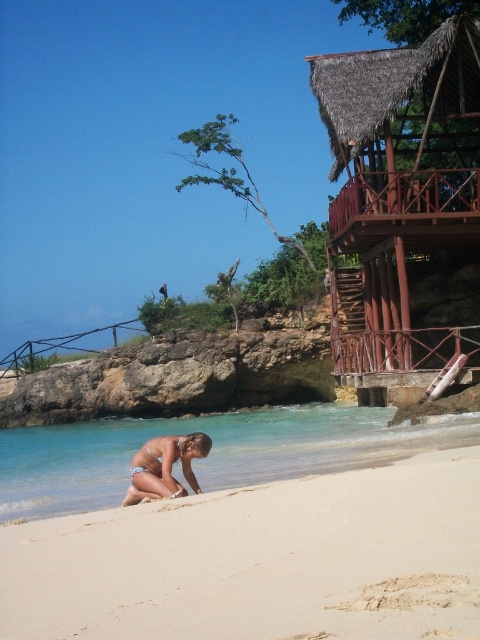
Which is in front, point (336, 636) or point (410, 170)?

Point (336, 636) is in front.

Is white sandy beach at lower center thinner than thatched wood hut at upper right?

Indeed, white sandy beach at lower center has a lesser width compared to thatched wood hut at upper right.

Describe the element at coordinates (261, 561) in the screenshot. I see `white sandy beach at lower center` at that location.

I want to click on white sandy beach at lower center, so click(x=261, y=561).

Which of these two, white sandy beach at lower center or clear blue water at lower center, stands shorter?

white sandy beach at lower center is shorter.

Is point (282, 593) in front of point (87, 428)?

That is True.

Is point (408, 506) closer to camera compared to point (111, 452)?

Yes, point (408, 506) is closer to viewer.

Image resolution: width=480 pixels, height=640 pixels. What are the coordinates of `white sandy beach at lower center` in the screenshot? It's located at (261, 561).

Is white sandy beach at lower center closer to the viewer compared to light blue bikini at lower center?

Yes, white sandy beach at lower center is in front of light blue bikini at lower center.

Can you confirm if white sandy beach at lower center is smaller than light blue bikini at lower center?

No, white sandy beach at lower center is not smaller than light blue bikini at lower center.

Image resolution: width=480 pixels, height=640 pixels. Describe the element at coordinates (261, 561) in the screenshot. I see `white sandy beach at lower center` at that location.

I want to click on white sandy beach at lower center, so click(x=261, y=561).